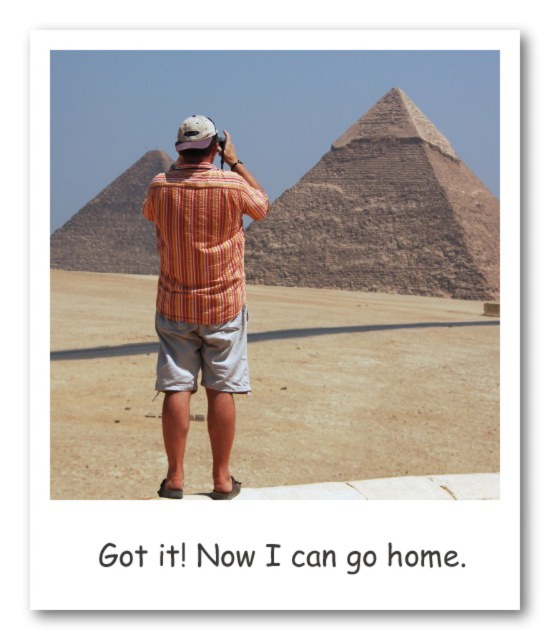
Which is more to the left, brown rough stone pyramid at center or orange striped shirt at center?

orange striped shirt at center is more to the left.

Which is behind, point (338, 288) or point (163, 218)?

Positioned behind is point (338, 288).

The image size is (550, 640). What do you see at coordinates (382, 214) in the screenshot?
I see `brown rough stone pyramid at center` at bounding box center [382, 214].

Locate an element on the screen. brown rough stone pyramid at center is located at coordinates (382, 214).

Does point (460, 298) lie behind point (154, 272)?

No.

Which is above, brown rough stone pyramid at center or brown stone pyramid at left?

Positioned higher is brown rough stone pyramid at center.

Does point (348, 259) lie in front of point (163, 164)?

Yes, it is.

The width and height of the screenshot is (550, 640). Identify the location of brown rough stone pyramid at center. (382, 214).

Who is positioned more to the right, orange striped shirt at center or brown stone pyramid at left?

orange striped shirt at center

Between point (222, 397) and point (79, 250), which one is positioned behind?

The point (79, 250) is behind.

Is point (176, 419) positioned in front of point (112, 220)?

That is True.

The width and height of the screenshot is (550, 640). Find the location of `orange striped shirt at center`. orange striped shirt at center is located at coordinates [x=200, y=292].